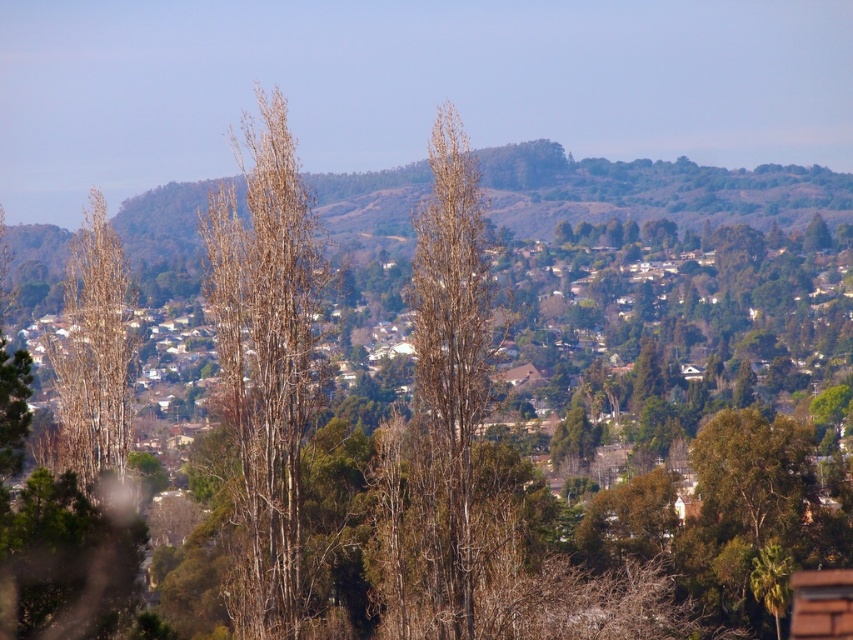
Question: Which object is positioned farthest from the bare wood tree at center?

Choices:
 (A) brown/dry wood tree at center
 (B) brown textured tree at left

Answer: (B)

Question: Is brown/dry wood tree at center thinner than bare wood tree at center?

Choices:
 (A) yes
 (B) no

Answer: (B)

Question: Does brown/dry wood tree at center appear under brown textured tree at left?

Choices:
 (A) no
 (B) yes

Answer: (A)

Question: Which object appears closest to the camera in this image?

Choices:
 (A) bare wood tree at center
 (B) brown textured tree at left

Answer: (A)

Question: Considering the real-world distances, which object is farthest from the bare wood tree at center?

Choices:
 (A) brown/dry wood tree at center
 (B) brown textured tree at left

Answer: (B)

Question: Is brown/dry wood tree at center above bare wood tree at center?

Choices:
 (A) no
 (B) yes

Answer: (B)